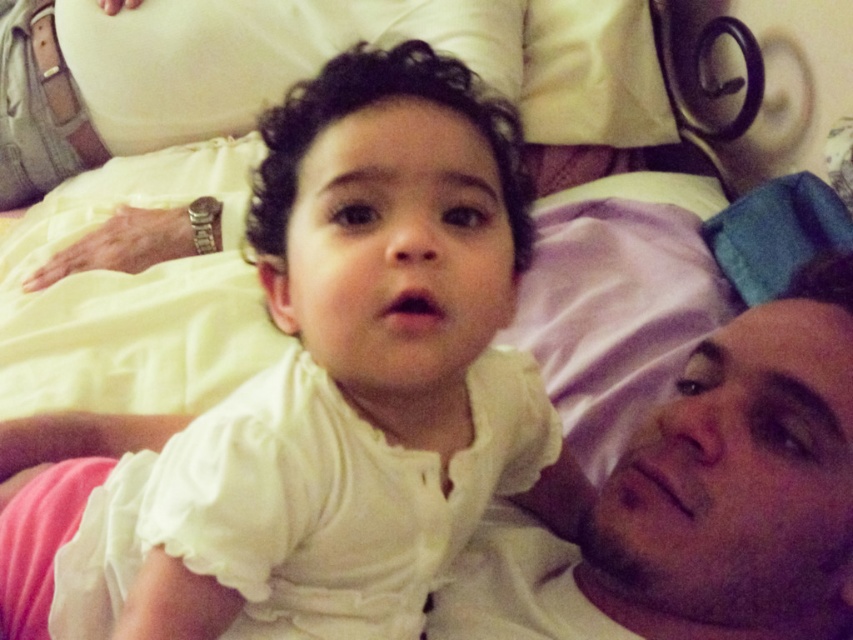
Question: Which of the following is the closest to the observer?

Choices:
 (A) white soft fabric at center
 (B) smooth skin face at center

Answer: (A)

Question: Is white soft fabric at center thinner than smooth skin face at center?

Choices:
 (A) no
 (B) yes

Answer: (A)

Question: Does white soft fabric at center have a lesser width compared to smooth skin face at center?

Choices:
 (A) yes
 (B) no

Answer: (B)

Question: Among these points, which one is nearest to the camera?

Choices:
 (A) (384, 100)
 (B) (590, 588)

Answer: (A)

Question: In this image, where is white soft fabric at center located relative to smooth skin face at center?

Choices:
 (A) right
 (B) left

Answer: (B)